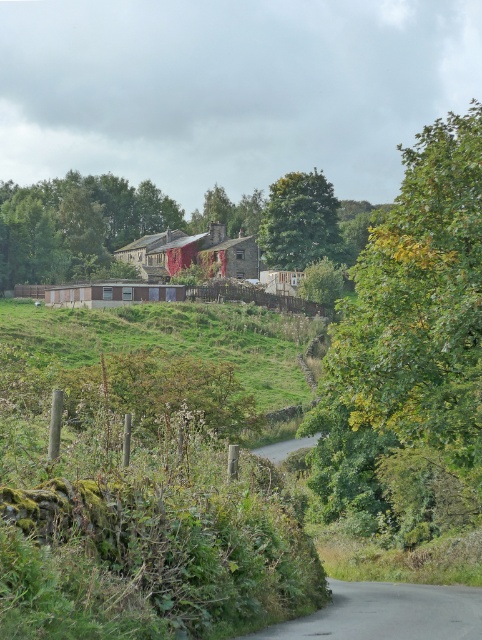
Question: Estimate the real-world distances between objects in this image. Which object is closer to the green leafy tree at upper left?

Choices:
 (A) green leafy tree at upper right
 (B) green grassy hillside at center

Answer: (B)

Question: Does green leafy tree at upper right appear on the right side of green grassy hillside at center?

Choices:
 (A) no
 (B) yes

Answer: (B)

Question: Does green leafy tree at upper left appear under green leafy tree at upper center?

Choices:
 (A) no
 (B) yes

Answer: (A)

Question: Which point is closer to the camera?

Choices:
 (A) (380, 275)
 (B) (215, 324)
 (C) (320, 244)
 (D) (38, 236)

Answer: (A)

Question: Estimate the real-world distances between objects in this image. Which object is farther from the green leafy tree at upper right?

Choices:
 (A) green leafy tree at upper center
 (B) green leafy tree at upper left
 (C) green grassy hillside at center

Answer: (B)

Question: Can you confirm if green leafy tree at upper right is positioned to the right of green leafy tree at upper center?

Choices:
 (A) no
 (B) yes

Answer: (B)